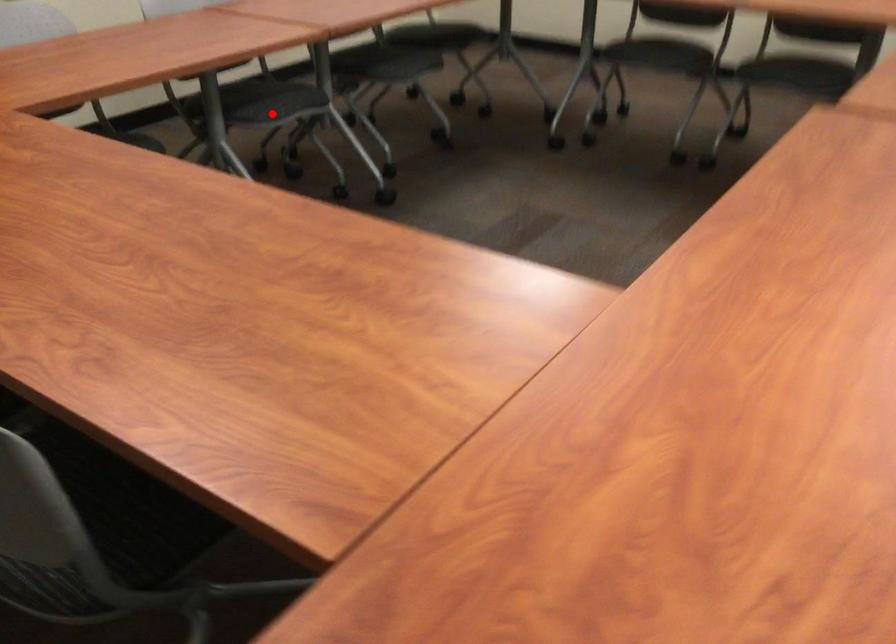
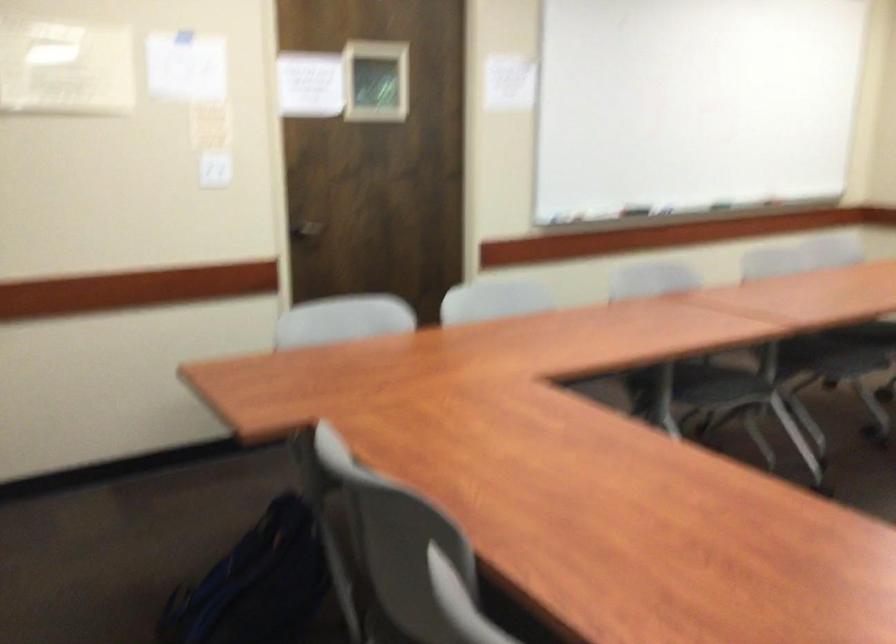
Where in the second image is the point corresponding to the highlighted location from the first image?

(712, 386)